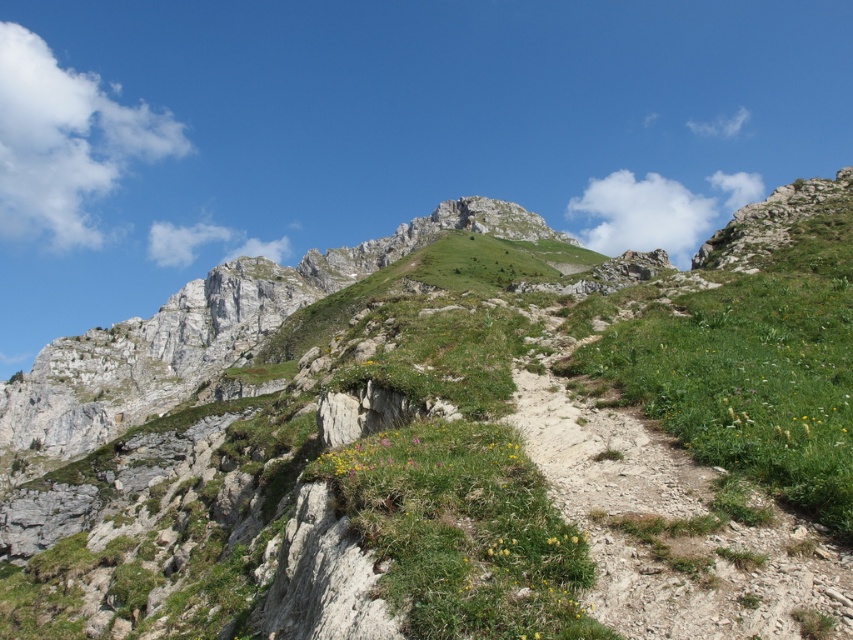
You are standing at the base of the mountain and see the green grassy mountain at upper center. If you were to draw a straight line from your current position to the peak, what coordinates would mark the midpoint of this line?

The midpoint would be at coordinates approximately halfway between your starting point and the peak. Since the green grassy mountain at upper center is located at point (450, 442), the midpoint can be calculated by averaging the coordinates of your starting position and the peak. However, without knowing your exact starting coordinates, we can only state the peak is at (450, 442).